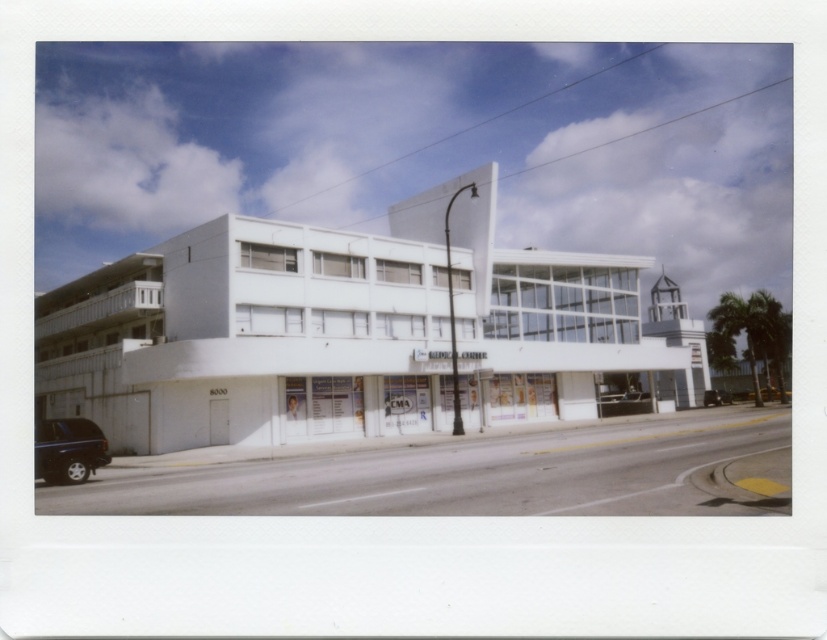
You are standing in front of the modern building and want to determine the relative positions of two points marked on the facade. Which point, point 1 at coordinates [55,477] or point 2 at coordinates [715,396], is closer to you?

Point 1 at coordinates [55,477] is closer to the viewer than point 2 at coordinates [715,396].

You are a delivery person who needs to park your vehicle in the parking lot behind the building. You have a shiny black suv at lower left and a black rubber car at center. Which vehicle should you move to park closer to the entrance of the building?

The black rubber car at center should be moved because it is closer to the entrance of the building than the shiny black suv at lower left, as they are 53.65 meters apart.